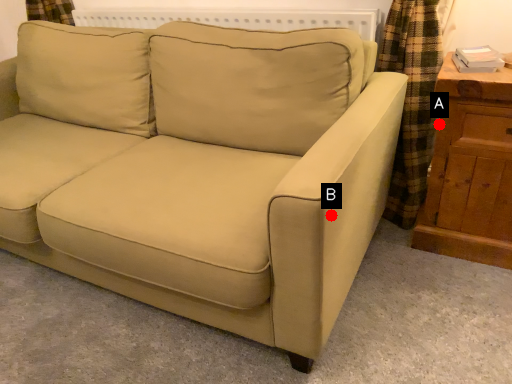
Question: Two points are circled on the image, labeled by A and B beside each circle. Which point is closer to the camera?

Choices:
 (A) A is closer
 (B) B is closer

Answer: (B)